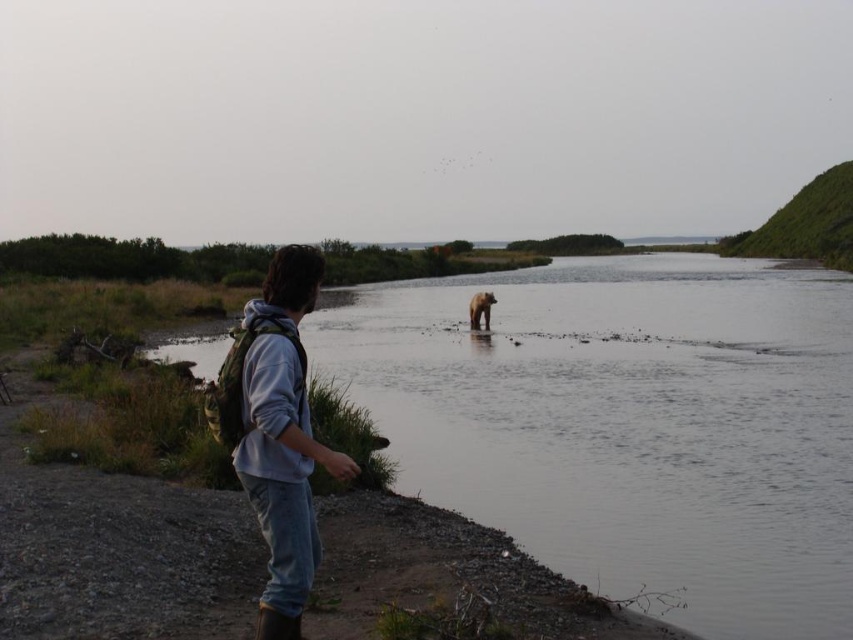
Question: Which is farther from the brown furry bear at center?

Choices:
 (A) brown fur river at center
 (B) denim pants at center

Answer: (B)

Question: From the image, what is the correct spatial relationship of denim pants at center in relation to brown furry bear at center?

Choices:
 (A) left
 (B) right

Answer: (A)

Question: Observing the image, what is the correct spatial positioning of denim pants at center in reference to brown furry bear at center?

Choices:
 (A) above
 (B) below

Answer: (B)

Question: Can you confirm if brown fur river at center is thinner than denim pants at center?

Choices:
 (A) yes
 (B) no

Answer: (B)

Question: Which object is closer to the camera taking this photo?

Choices:
 (A) denim pants at center
 (B) brown furry bear at center
 (C) brown fur river at center

Answer: (A)

Question: Which of the following is the farthest from the observer?

Choices:
 (A) [520, 435]
 (B) [486, 324]
 (C) [245, 404]

Answer: (B)